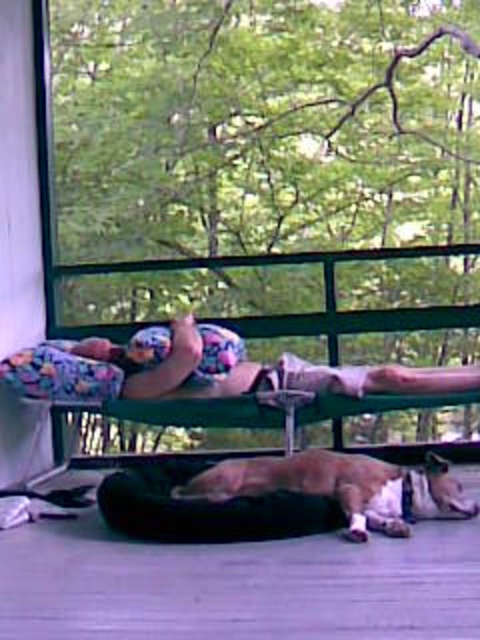
Which of these two, floral fabric person at center or brown fur dog at lower center, stands taller?

Standing taller between the two is floral fabric person at center.

Is floral fabric person at center positioned before brown fur dog at lower center?

No.

Where is `floral fabric person at center`? The image size is (480, 640). floral fabric person at center is located at coordinates (210, 380).

Is point (84, 582) more distant than point (354, 502)?

No, (84, 582) is in front of (354, 502).

Can you confirm if black fabric dog bed at lower center is positioned above brown fur dog at lower center?

Incorrect, black fabric dog bed at lower center is not positioned above brown fur dog at lower center.

The width and height of the screenshot is (480, 640). In order to click on black fabric dog bed at lower center in this screenshot , I will do `click(238, 586)`.

At what (x,y) coordinates should I click in order to perform the action: click on black fabric dog bed at lower center. Please return your answer as a coordinate pair (x, y). Looking at the image, I should click on (238, 586).

Between black fabric dog bed at lower center and floral fabric person at center, which one is positioned higher?

floral fabric person at center is higher up.

Is black fabric dog bed at lower center smaller than floral fabric person at center?

Yes, black fabric dog bed at lower center is smaller than floral fabric person at center.

What do you see at coordinates (238, 586) in the screenshot? The width and height of the screenshot is (480, 640). I see `black fabric dog bed at lower center` at bounding box center [238, 586].

The image size is (480, 640). I want to click on black fabric dog bed at lower center, so click(238, 586).